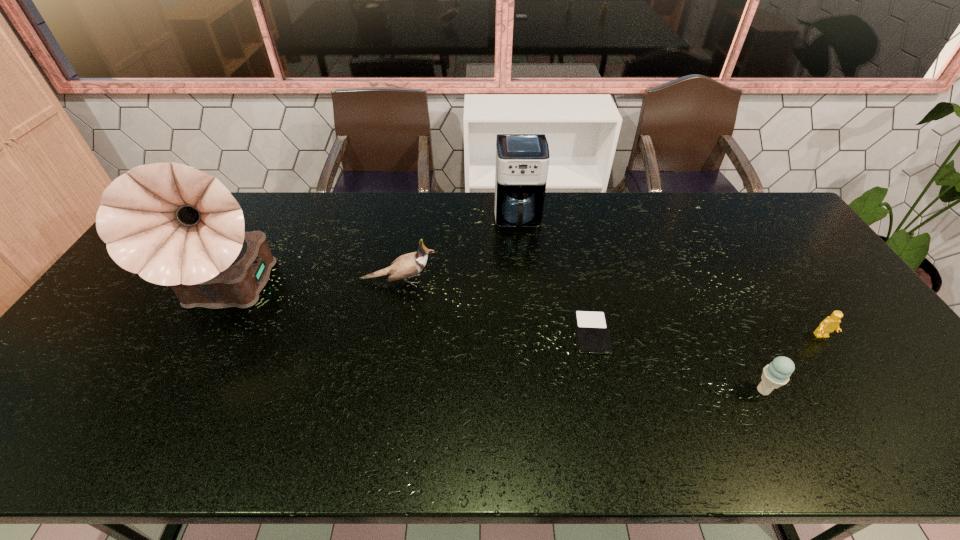
The height and width of the screenshot is (540, 960). I want to click on vacant area that lies between the second object from right to left and the leftmost object, so click(x=496, y=343).

Identify the location of object that is the fourth nearest to the Lego. This screenshot has height=540, width=960. (408, 265).

Select which object is the second closest to the third object from left to right. Please provide its 2D coordinates. Your answer should be formatted as a tuple, i.e. [(x, y)], where the tuple contains the x and y coordinates of a point satisfying the conditions above.

[(592, 331)]

Locate an element on the screen. This screenshot has height=540, width=960. vacant space that satisfies the following two spatial constraints: 1. from the horn of the record player; 2. on the right side of the fourth object from left to right is located at coordinates (210, 333).

Find the location of a particular element. The image size is (960, 540). vacant region that satisfies the following two spatial constraints: 1. from the horn of the record player; 2. on the right side of the ice cream is located at coordinates (179, 390).

This screenshot has height=540, width=960. I want to click on free location that satisfies the following two spatial constraints: 1. on the back side of the ice cream; 2. at the face of the bird, so click(708, 281).

Where is `vacant area in the image that satisfies the following two spatial constraints: 1. on the front panel of the second tallest object; 2. on the right side of the third object from right to left`? vacant area in the image that satisfies the following two spatial constraints: 1. on the front panel of the second tallest object; 2. on the right side of the third object from right to left is located at coordinates (528, 333).

You are a GUI agent. You are given a task and a screenshot of the screen. Output one action in this format:
    pyautogui.click(x=<x>, y=<y>)
    Task: Click on the vacant space that satisfies the following two spatial constraints: 1. at the face of the second object from left to right; 2. from the horn of the leftmost object
    Image resolution: width=960 pixels, height=540 pixels.
    Given the screenshot: What is the action you would take?
    pyautogui.click(x=396, y=296)

Locate an element on the screen. This screenshot has height=540, width=960. free space that satisfies the following two spatial constraints: 1. on the back side of the nearest object; 2. at the face of the fifth object from right to left is located at coordinates (708, 281).

The width and height of the screenshot is (960, 540). Identify the location of free point that satisfies the following two spatial constraints: 1. at the face of the fifth object from right to left; 2. from the horn of the record player. (396, 296).